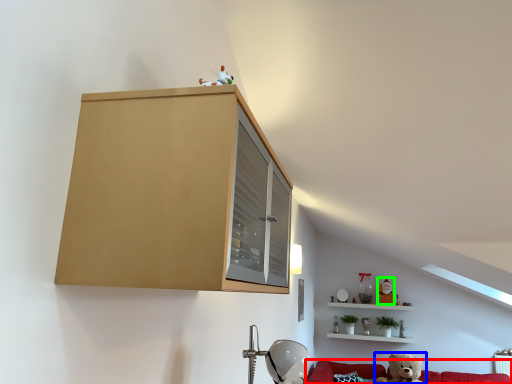
Question: Which object is positioned farthest from couch (highlighted by a red box)? Select from toy (highlighted by a blue box) and toy (highlighted by a green box).

Choices:
 (A) toy
 (B) toy

Answer: (B)